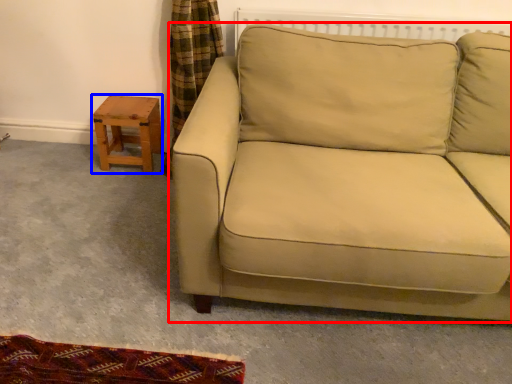
Question: Which object appears closest to the camera in this image, studio couch (highlighted by a red box) or table (highlighted by a blue box)?

Choices:
 (A) studio couch
 (B) table

Answer: (A)